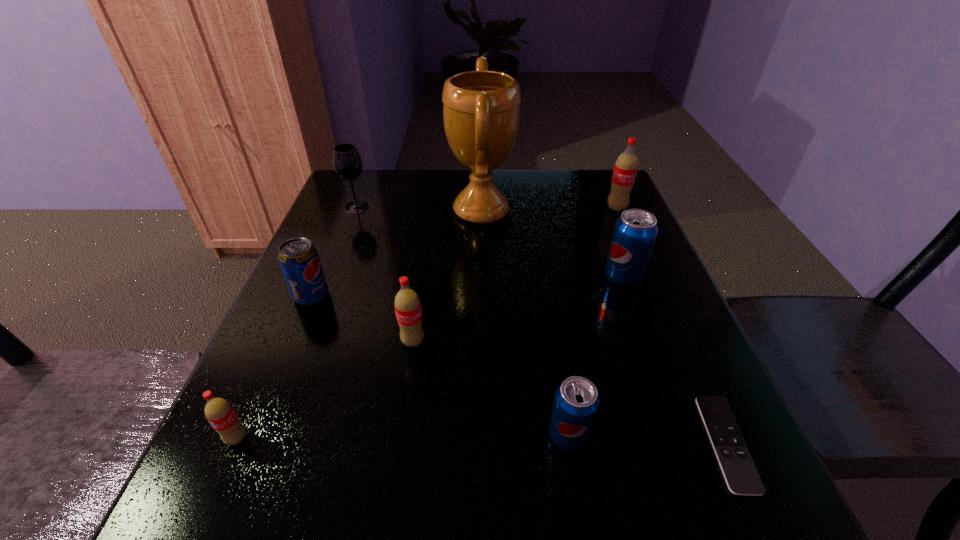
The image size is (960, 540). I want to click on vacant space at the near right corner, so click(729, 539).

What are the coordinates of `free space between the third nearest pop soda and the sixth object from left to right` in the screenshot? It's located at (491, 388).

Where is `vacant area that lies between the nearest red soda and the black remote control`? The image size is (960, 540). vacant area that lies between the nearest red soda and the black remote control is located at coordinates (481, 441).

This screenshot has height=540, width=960. I want to click on free space between the nearest red soda and the remote control, so click(x=481, y=441).

Locate an element on the screen. This screenshot has width=960, height=540. vacant area that lies between the fourth object from left to right and the smallest red soda is located at coordinates (324, 389).

The width and height of the screenshot is (960, 540). In order to click on unoccupied position between the shortest object and the farther blue pop soda in this screenshot , I will do `click(675, 360)`.

Locate an element on the screen. Image resolution: width=960 pixels, height=540 pixels. blank region between the wineglass and the fourth object from right to left is located at coordinates (463, 321).

This screenshot has width=960, height=540. I want to click on vacant space that is in between the nearer blue pop soda and the shortest object, so click(x=647, y=439).

I want to click on vacant space that is in between the fifth object from right to left and the fourth object from left to right, so click(447, 276).

I want to click on free space between the tallest object and the shortest object, so click(x=604, y=327).